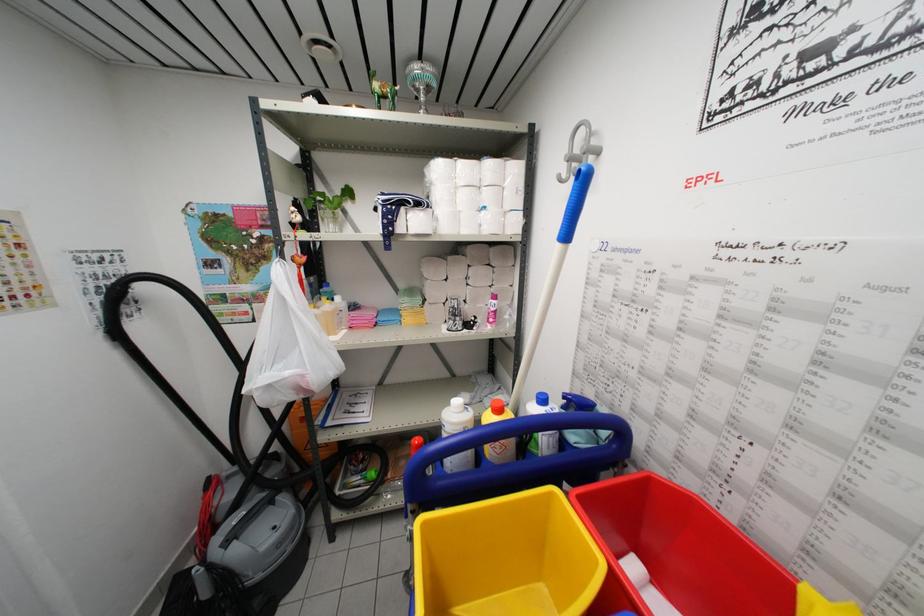
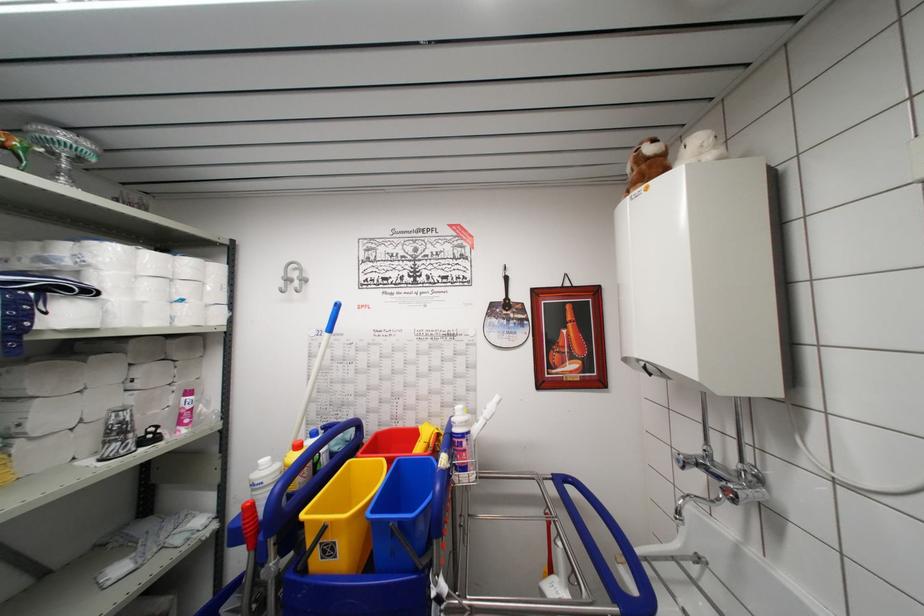
Where in the second image is the point corresponding to (507,217) from the first image?

(211, 310)